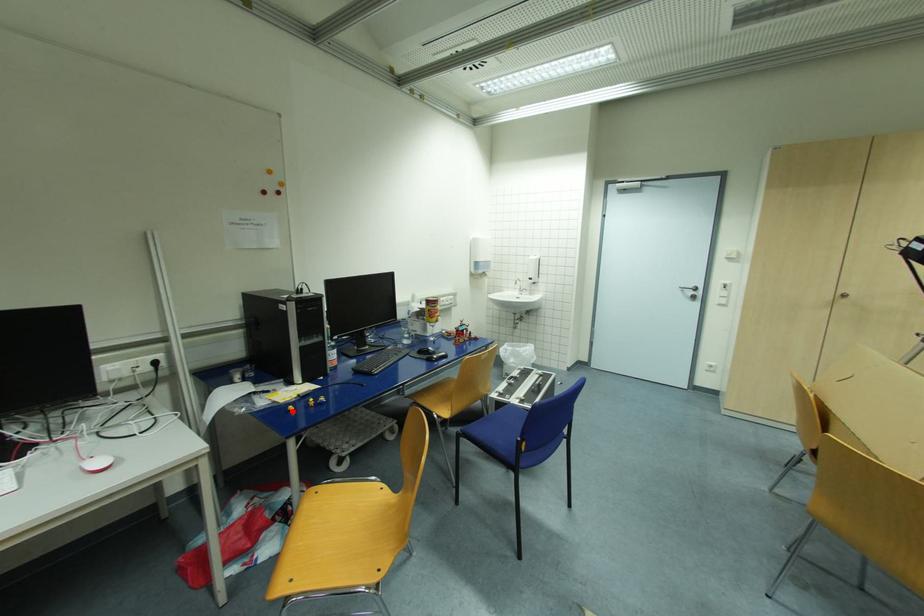
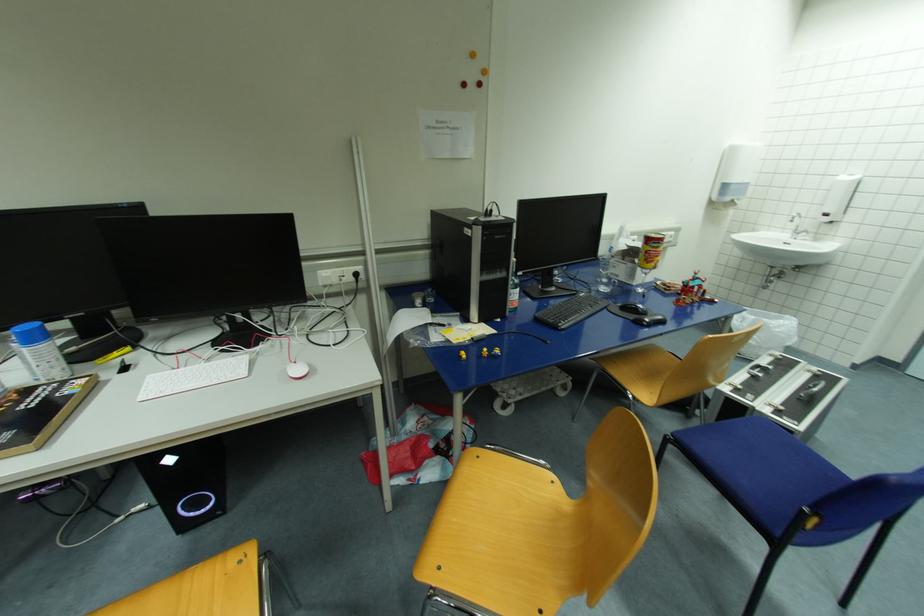
Locate, in the second image, the point that corresponds to the highlighted location in the first image.

(465, 358)